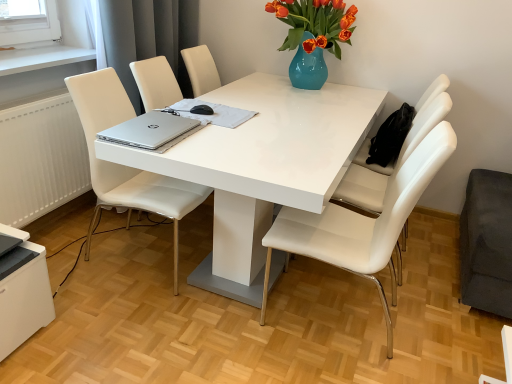
Identify the location of vacant space that is in between silver metallic laptop at center and silver metallic laptop at center. (199, 134).